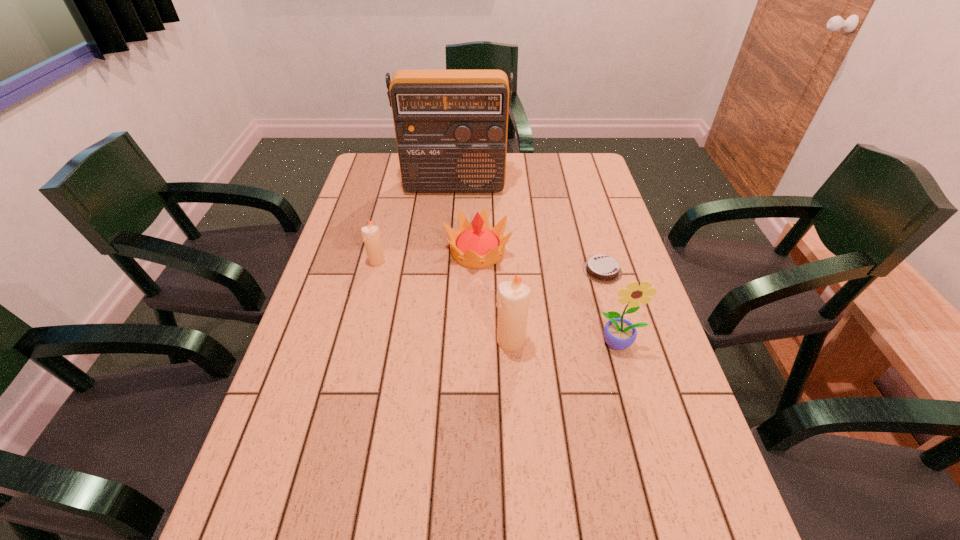
Locate an element on the screen. The height and width of the screenshot is (540, 960). the farther candle is located at coordinates (371, 235).

Locate an element on the screen. The image size is (960, 540). the left candle is located at coordinates (371, 235).

Locate an element on the screen. The width and height of the screenshot is (960, 540). the taller candle is located at coordinates (513, 298).

I want to click on the right candle, so click(x=513, y=298).

Locate an element on the screen. This screenshot has width=960, height=540. radio receiver is located at coordinates (451, 126).

Identify the location of the farthest object. (451, 126).

The width and height of the screenshot is (960, 540). I want to click on the shortest object, so 600,268.

You are a GUI agent. You are given a task and a screenshot of the screen. Output one action in this format:
    pyautogui.click(x=<x>, y=<y>)
    Task: Click on the crown
    The image size is (960, 540).
    Given the screenshot: What is the action you would take?
    pyautogui.click(x=477, y=245)

Locate an element on the screen. The height and width of the screenshot is (540, 960). sunflower is located at coordinates (619, 333).

In order to click on vacant space situated 0.220m on the right of the farther candle in this screenshot , I will do `click(460, 261)`.